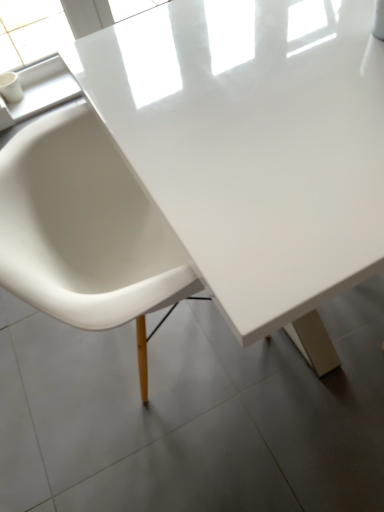
At what (x,y) coordinates should I click in order to perform the action: click on white glossy table at center. Please return your answer as a coordinate pair (x, y). This screenshot has height=512, width=384. Looking at the image, I should click on click(254, 148).

The width and height of the screenshot is (384, 512). What do you see at coordinates (254, 148) in the screenshot?
I see `white glossy table at center` at bounding box center [254, 148].

The width and height of the screenshot is (384, 512). I want to click on white glossy table at center, so click(254, 148).